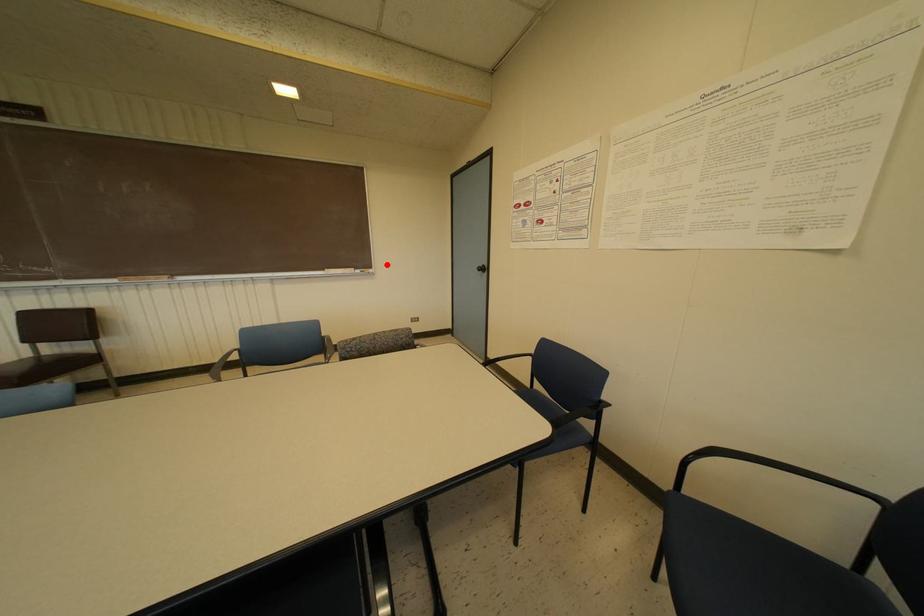
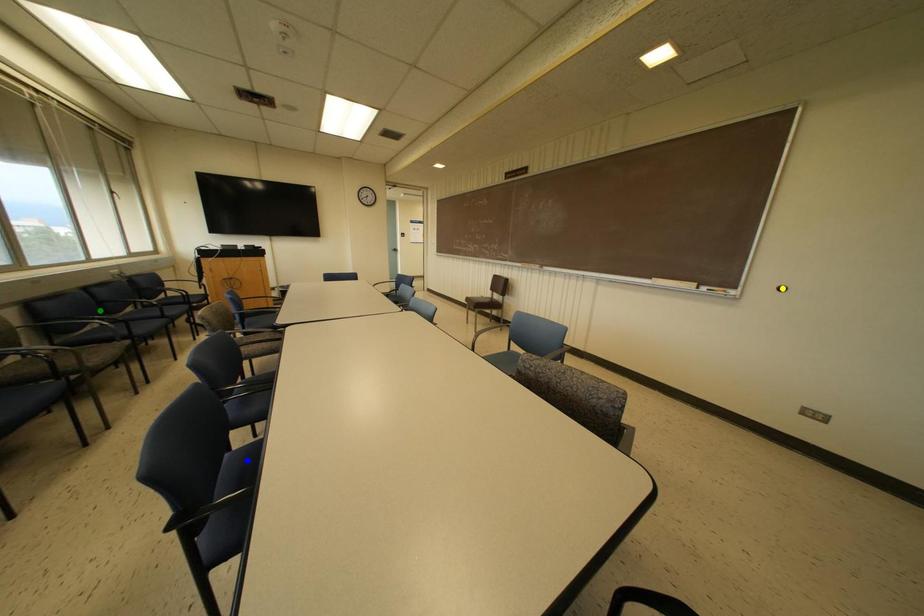
Question: I am providing you with two images of the same scene from different viewpoints. A red point is marked on the first image. You are given multiple points on the second image. Which point in image 2 represents the same 3d spot as the red point in image 1?

Choices:
 (A) blue point
 (B) yellow point
 (C) green point

Answer: (B)